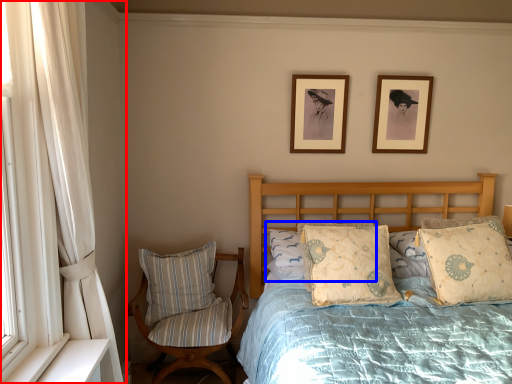
Question: Which point is closer to the camera, curtain (highlighted by a red box) or pillow (highlighted by a blue box)?

Choices:
 (A) curtain
 (B) pillow

Answer: (A)